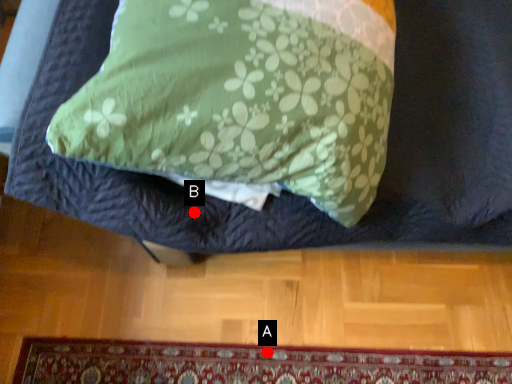
Question: Two points are circled on the image, labeled by A and B beside each circle. Among these points, which one is farthest from the camera?

Choices:
 (A) A is further
 (B) B is further

Answer: (A)